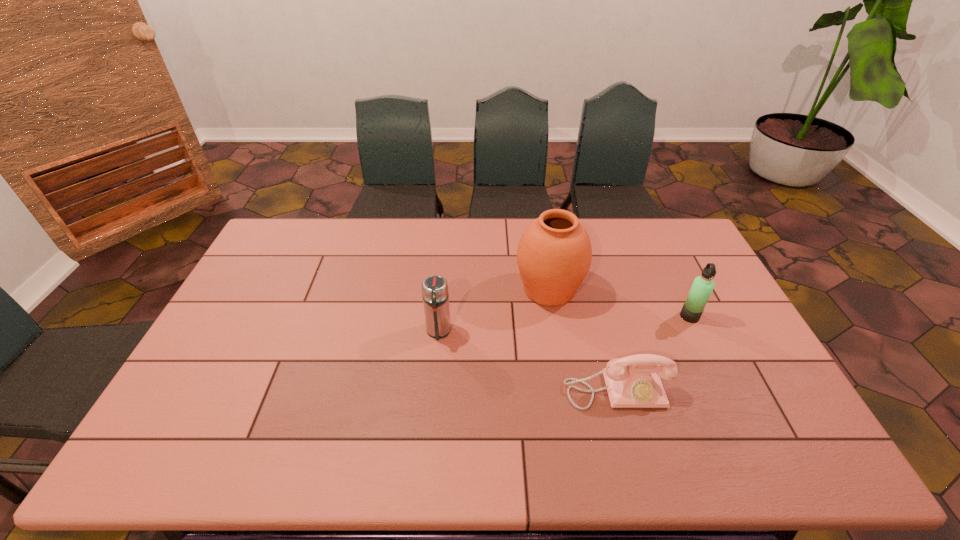
The image size is (960, 540). I want to click on free space between the tallest object and the leftmost object, so click(493, 310).

The width and height of the screenshot is (960, 540). In order to click on vacant point located between the left thermos bottle and the urn in this screenshot , I will do `click(493, 310)`.

Locate an element on the screen. free spot between the tallest object and the leftmost object is located at coordinates (493, 310).

Identify the location of vacant region between the right thermos bottle and the telephone. (653, 353).

I want to click on free space that is in between the nearest object and the urn, so click(583, 340).

Where is `free space between the left thermos bottle and the tallest object`? The width and height of the screenshot is (960, 540). free space between the left thermos bottle and the tallest object is located at coordinates (493, 310).

Choose which object is the third nearest neighbor to the urn. Please provide its 2D coordinates. Your answer should be formatted as a tuple, i.e. [(x, y)], where the tuple contains the x and y coordinates of a point satisfying the conditions above.

[(702, 287)]

Find the location of a particular element. object that is the third closest one to the tallest object is located at coordinates (702, 287).

Locate an element on the screen. The width and height of the screenshot is (960, 540). vacant region that satisfies the following two spatial constraints: 1. on the front side of the rightmost object; 2. on the left side of the tallest object is located at coordinates (554, 316).